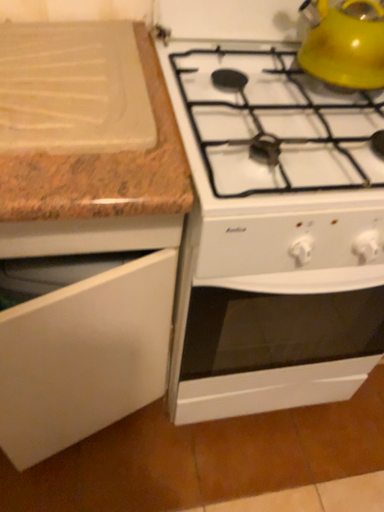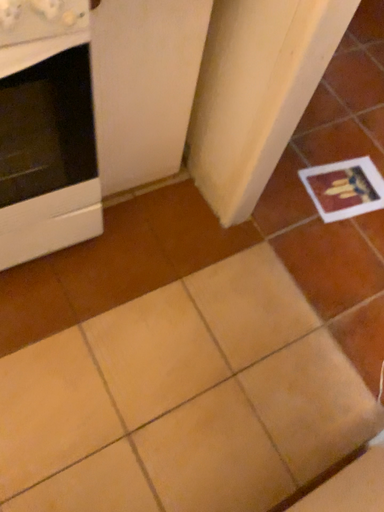
Question: How did the camera likely rotate when shooting the video?

Choices:
 (A) rotated downward
 (B) rotated upward

Answer: (A)